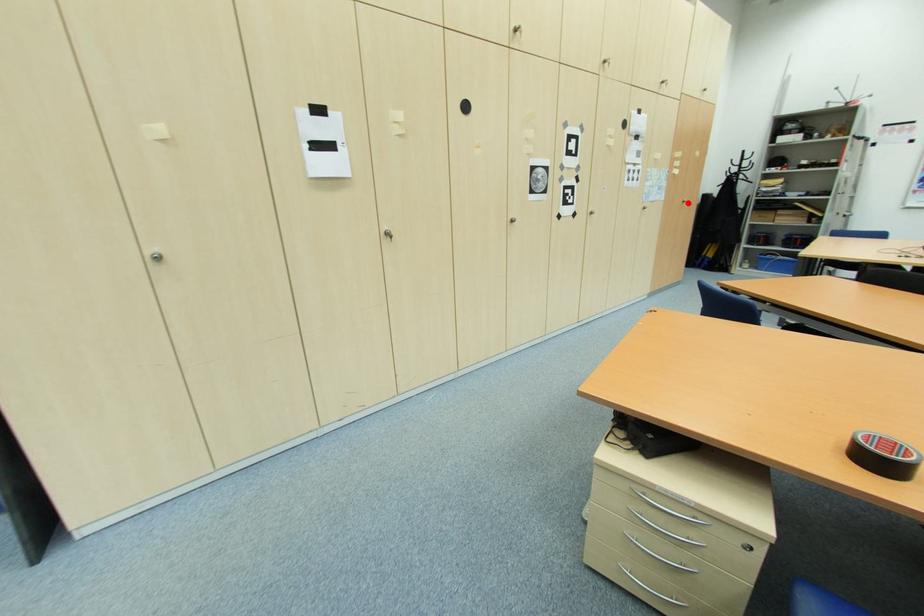
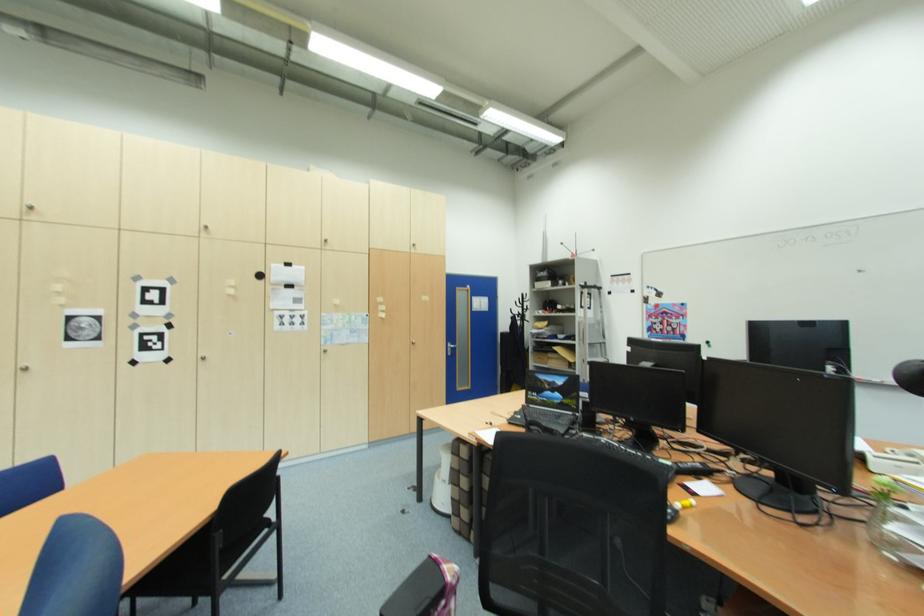
Question: I am providing you with two images of the same scene from different viewpoints. Image1 has a red point marked. In image2, the corresponding 3D location appears at what relative position? Reply with the corresponding letter.

Choices:
 (A) Closer
 (B) Farther

Answer: (B)